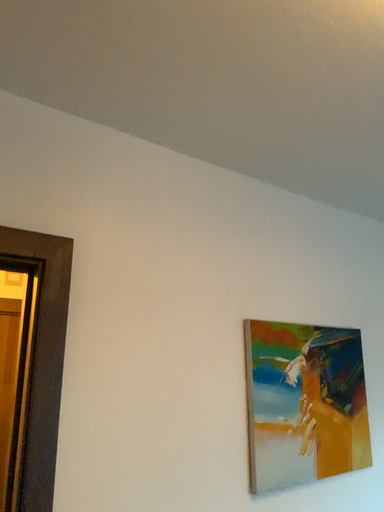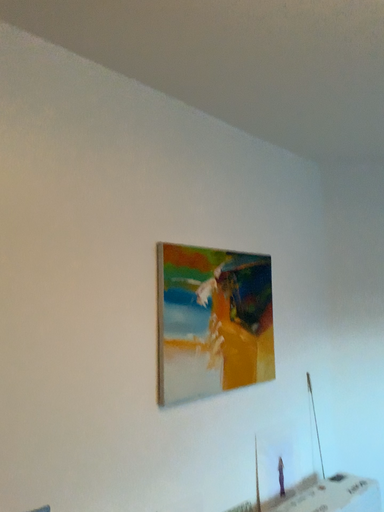
Question: Which way did the camera rotate in the video?

Choices:
 (A) rotated downward
 (B) rotated upward

Answer: (A)